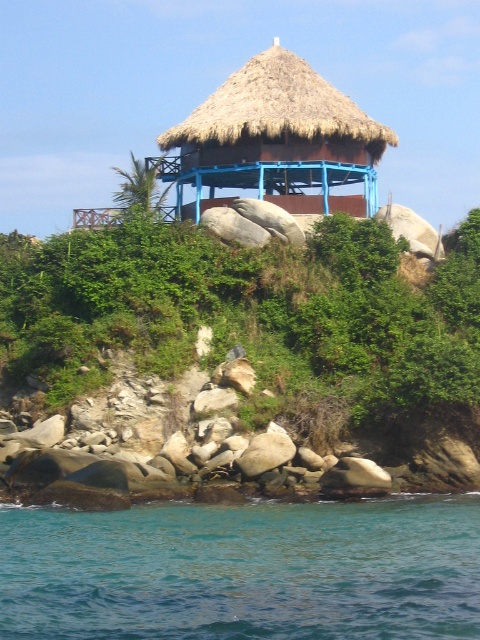
In the scene shown: You are standing on the rocky outcrop and want to pour water from the blue liquid water at lower center into a container placed near the thatched straw hut at center. Can you do this without the water spilling over?

The blue liquid water at lower center is not as tall as the thatched straw hut at center, so pouring water from a lower position into a container placed higher up may cause splashing or spillage due to the elevation difference. Be cautious to pour slowly to minimize spillage.

In the scene shown: You are a hiker who has just arrived at the coastal area. You see the green leafy shrubs at center and the blue liquid water at lower center. Which one is higher in elevation?

The green leafy shrubs at center is above the blue liquid water at lower center, so the green leafy shrubs at center is higher in elevation.

From the picture: You are a tourist visiting this coastal area and want to take a photo of the blue liquid water at lower center and the thatched straw hut at center. Which object should you focus on first if you want to capture both in the same frame without moving your camera?

The blue liquid water at lower center has a smaller size compared to the thatched straw hut at center, so you should focus on the thatched straw hut at center first to ensure it is in focus, then adjust exposure for the blue liquid water at lower center.